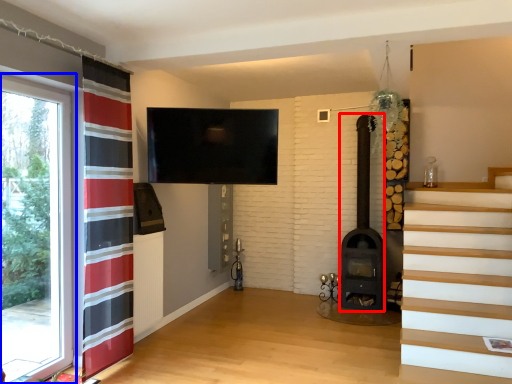
Question: Which of the following is the closest to the observer, fireplace (highlighted by a red box) or window (highlighted by a blue box)?

Choices:
 (A) fireplace
 (B) window

Answer: (B)